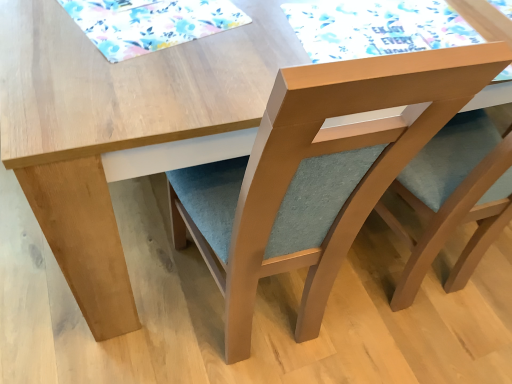
Question: In terms of height, does matte wood chair at center look taller or shorter compared to watercolor paper placemat at upper center, the second mat from the left?

Choices:
 (A) tall
 (B) short

Answer: (A)

Question: Would you say matte wood chair at center is inside or outside watercolor paper placemat at upper center, the second mat from the left?

Choices:
 (A) outside
 (B) inside

Answer: (A)

Question: Estimate the real-world distances between objects in this image. Which object is farther from the matte wood chair at center?

Choices:
 (A) watercolor paper placemat at upper center, which is counted as the first mat, starting from the right
 (B) floral fabric placemat at upper left, which is the second mat from right to left

Answer: (B)

Question: Estimate the real-world distances between objects in this image. Which object is farther from the matte wood chair at center?

Choices:
 (A) floral fabric placemat at upper left, which is the second mat from right to left
 (B) watercolor paper placemat at upper center, the second mat from the left

Answer: (A)